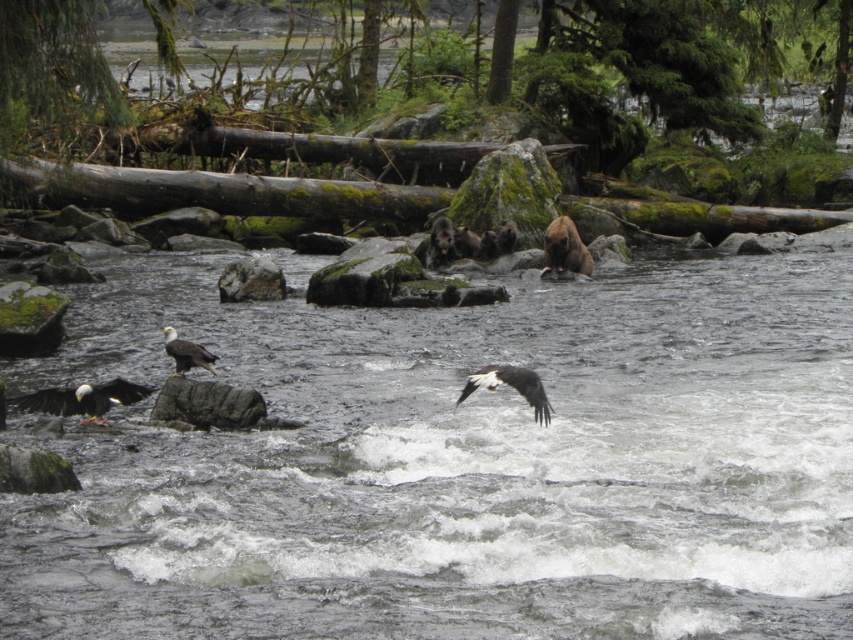
Question: Among these objects, which one is farthest from the camera?

Choices:
 (A) gray rough rock at center
 (B) clear water at center

Answer: (A)

Question: Does white-feathered bald eagle at lower left have a smaller size compared to white-feathered eagle at lower left?

Choices:
 (A) yes
 (B) no

Answer: (B)

Question: Does white-feathered bald eagle at lower left come in front of white-feathered eagle at lower left?

Choices:
 (A) yes
 (B) no

Answer: (A)

Question: Which object is positioned closest to the gray rough rock at center?

Choices:
 (A) brown furry bear at upper right
 (B) white-feathered bald eagle at lower left

Answer: (B)

Question: Does clear water at center appear on the right side of white-feathered eagle at center?

Choices:
 (A) no
 (B) yes

Answer: (A)

Question: Which of the following is the farthest from the observer?

Choices:
 (A) brown furry bear at upper right
 (B) white-feathered eagle at lower left

Answer: (A)